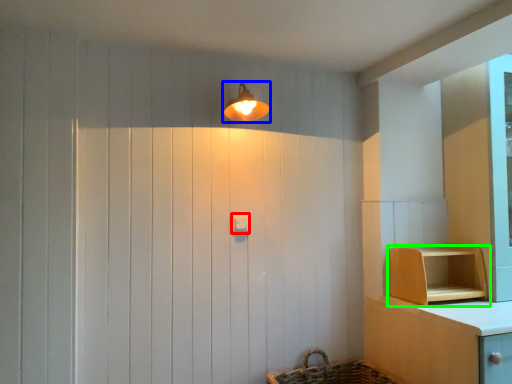
Question: Considering the real-world distances, which object is closest to light switch (highlighted by a red box)? light fixture (highlighted by a blue box) or shelf (highlighted by a green box).

Choices:
 (A) light fixture
 (B) shelf

Answer: (A)